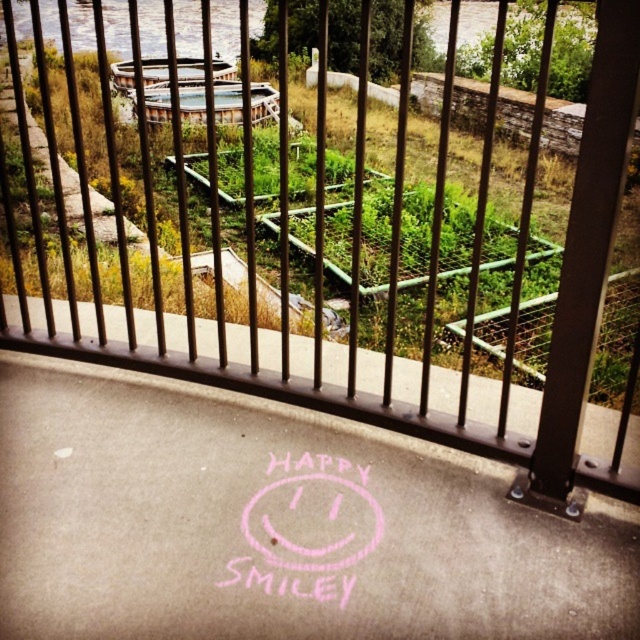
Question: Which object is closer to the camera taking this photo?

Choices:
 (A) pink chalk smiley face at center
 (B) pink chalk drawing at center

Answer: (B)

Question: Does pink chalk drawing at center have a lesser width compared to pink chalk smiley face at center?

Choices:
 (A) yes
 (B) no

Answer: (B)

Question: Which object is farther from the camera taking this photo?

Choices:
 (A) pink chalk smiley face at center
 (B) pink chalk drawing at center

Answer: (A)

Question: Can you confirm if pink chalk drawing at center is positioned above pink chalk smiley face at center?

Choices:
 (A) no
 (B) yes

Answer: (B)

Question: Can you confirm if pink chalk drawing at center is thinner than pink chalk smiley face at center?

Choices:
 (A) yes
 (B) no

Answer: (B)